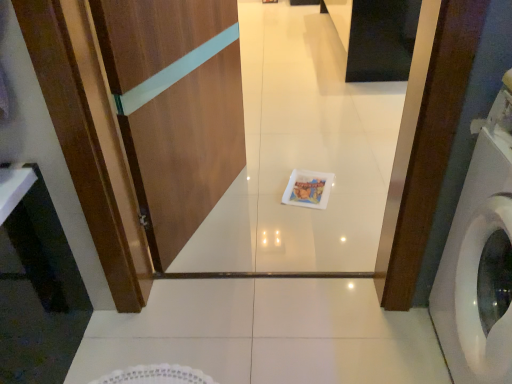
Describe the element at coordinates (375, 36) in the screenshot. The height and width of the screenshot is (384, 512). I see `black glossy cabinet at upper center` at that location.

I want to click on black glossy cabinet at upper center, so click(x=375, y=36).

Between wooden screen door at center and white plastic washing machine at right, which one has larger size?

white plastic washing machine at right is bigger.

Does wooden screen door at center appear on the left side of white plastic washing machine at right?

Yes, wooden screen door at center is to the left of white plastic washing machine at right.

Does point (223, 171) appear closer or farther from the camera than point (435, 289)?

Point (223, 171) appears to be farther away from the viewer than point (435, 289).

From a real-world perspective, which is physically below, white plastic washing machine at right or wooden screen door at center?

white plastic washing machine at right is physically lower.

How much distance is there between white plastic washing machine at right and wooden screen door at center?

white plastic washing machine at right is 38.43 inches from wooden screen door at center.

Considering the relative sizes of white plastic washing machine at right and wooden screen door at center in the image provided, is white plastic washing machine at right bigger than wooden screen door at center?

Yes.

Which is closer to the camera, (463, 373) or (163, 0)?

Point (463, 373) is positioned closer to the camera compared to point (163, 0).

Is white plastic washing machine at right inside black glossy cabinet at upper center?

Definitely not — white plastic washing machine at right is not inside black glossy cabinet at upper center.

The image size is (512, 384). I want to click on cabinetry located above the white plastic washing machine at right (from the image's perspective), so click(375, 36).

From the image's perspective, does black glossy cabinet at upper center appear lower than white plastic washing machine at right?

No.

Between point (376, 80) and point (450, 309), which one is positioned in front?

Positioned in front is point (450, 309).

Is white plastic washing machine at right turned away from black glossy cabinet at upper center?

white plastic washing machine at right is not turned away from black glossy cabinet at upper center.

Which object is positioned more to the left, white plastic washing machine at right or black glossy cabinet at upper center?

white plastic washing machine at right is more to the left.

Considering the points (499, 380) and (401, 2), which point is in front, point (499, 380) or point (401, 2)?

The point (499, 380) is more forward.

What's the angular difference between white plastic washing machine at right and black glossy cabinet at upper center's facing directions?

The facing directions of white plastic washing machine at right and black glossy cabinet at upper center are 0.53 degrees apart.

Would you say black glossy cabinet at upper center is inside or outside wooden screen door at center?

black glossy cabinet at upper center is spatially situated outside wooden screen door at center.

Is point (403, 7) positioned in front of point (139, 43)?

No.

How far apart are black glossy cabinet at upper center and wooden screen door at center?

They are 5.57 feet apart.

How different are the orientations of black glossy cabinet at upper center and wooden screen door at center in degrees?

black glossy cabinet at upper center and wooden screen door at center are facing 160 degrees away from each other.

In the image, is wooden screen door at center positioned in front of or behind black glossy cabinet at upper center?

wooden screen door at center is positioned closer to the viewer than black glossy cabinet at upper center.

From a real-world perspective, is wooden screen door at center above or below black glossy cabinet at upper center?

wooden screen door at center is situated higher than black glossy cabinet at upper center in the real world.

How far apart are wooden screen door at center and black glossy cabinet at upper center?

5.57 feet.

From the image's perspective, does wooden screen door at center appear higher than black glossy cabinet at upper center?

Incorrect, from the image's perspective, wooden screen door at center is lower than black glossy cabinet at upper center.

Identify the location of screen door that is above the white plastic washing machine at right (from the image's perspective). This screenshot has width=512, height=384. (175, 108).

Find the location of a particular element. The height and width of the screenshot is (384, 512). washing machine below the wooden screen door at center (from the image's perspective) is located at coordinates (478, 256).

Which object lies further to the anchor point wooden screen door at center, black glossy cabinet at upper center or white plastic washing machine at right?

black glossy cabinet at upper center is positioned further to the anchor wooden screen door at center.

Looking at the image, which one is located closer to white plastic washing machine at right, wooden screen door at center or black glossy cabinet at upper center?

wooden screen door at center is positioned closer to the anchor white plastic washing machine at right.

Based on their spatial positions, is wooden screen door at center or white plastic washing machine at right further from black glossy cabinet at upper center?

white plastic washing machine at right is further to black glossy cabinet at upper center.

Consider the image. From the image, which object appears to be farther from white plastic washing machine at right, black glossy cabinet at upper center or wooden screen door at center?

black glossy cabinet at upper center is positioned further to the anchor white plastic washing machine at right.

Considering their positions, is white plastic washing machine at right positioned further to black glossy cabinet at upper center than wooden screen door at center?

Among the two, white plastic washing machine at right is located further to black glossy cabinet at upper center.

When comparing their distances from wooden screen door at center, does white plastic washing machine at right or black glossy cabinet at upper center seem further?

Among the two, black glossy cabinet at upper center is located further to wooden screen door at center.

Image resolution: width=512 pixels, height=384 pixels. What are the coordinates of `screen door between white plastic washing machine at right and black glossy cabinet at upper center in the front-back direction` in the screenshot? It's located at (175, 108).